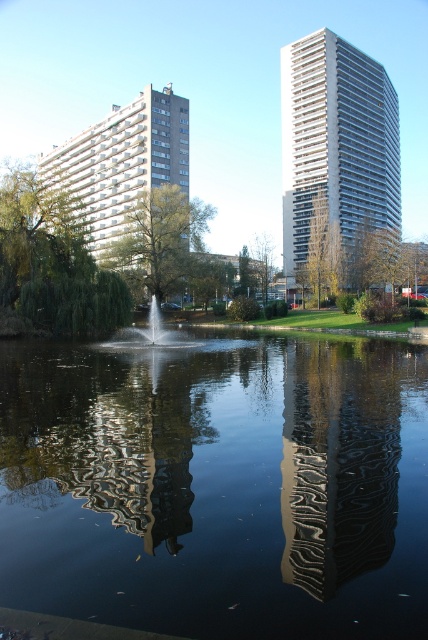
Question: Which object is closer to the camera taking this photo?

Choices:
 (A) white glossy building at upper center
 (B) glossy metallic building at center
 (C) smooth reflective water at center

Answer: (C)

Question: Is glossy metallic building at center positioned behind white glossy building at upper center?

Choices:
 (A) yes
 (B) no

Answer: (B)

Question: Among these objects, which one is nearest to the camera?

Choices:
 (A) white textured building at left
 (B) smooth reflective water at center

Answer: (B)

Question: Which of the following is the closest to the observer?

Choices:
 (A) white glossy fountain at center
 (B) smooth reflective water at center

Answer: (B)

Question: In this image, where is smooth reflective water at center located relative to white glossy building at upper center?

Choices:
 (A) right
 (B) left

Answer: (B)

Question: Is white glossy building at upper center bigger than white textured building at left?

Choices:
 (A) no
 (B) yes

Answer: (B)